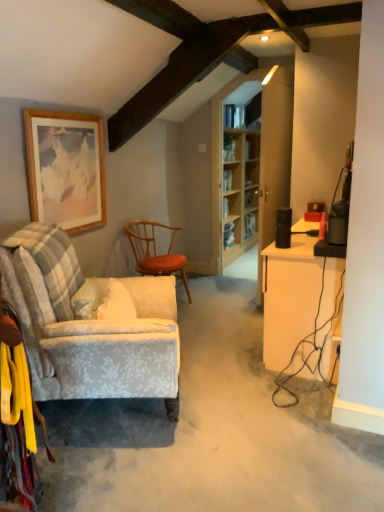
Question: Is clear glass shelves at center wider or thinner than white glossy desk at right?

Choices:
 (A) wide
 (B) thin

Answer: (B)

Question: From a real-world perspective, relative to white glossy desk at right, is clear glass shelves at center vertically above or below?

Choices:
 (A) above
 (B) below

Answer: (A)

Question: Which object is the closest to the clear glass shelves at center?

Choices:
 (A) white glossy desk at right
 (B) wooden picture frame at upper left
 (C) light blue fabric armchair at left, which ranks as the 1th chair in front-to-back order
 (D) wooden textured chair at center, which appears as the second chair when viewed from the front

Answer: (D)

Question: Based on their relative distances, which object is nearer to the clear glass shelves at center?

Choices:
 (A) wooden picture frame at upper left
 (B) light blue fabric armchair at left, which is the second chair in back-to-front order
 (C) white glossy desk at right
 (D) wooden textured chair at center, which appears as the second chair when viewed from the front

Answer: (D)